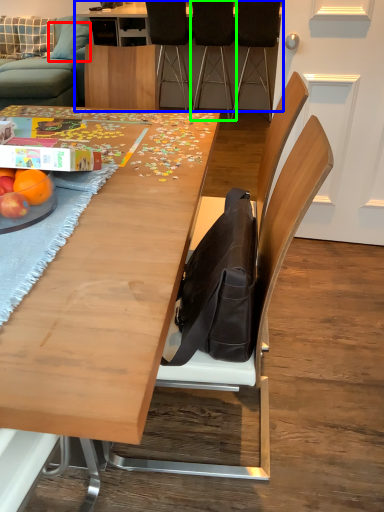
Question: Considering the real-world distances, which object is closest to pillow (highlighted by a red box)? table (highlighted by a blue box) or chair (highlighted by a green box).

Choices:
 (A) table
 (B) chair

Answer: (A)